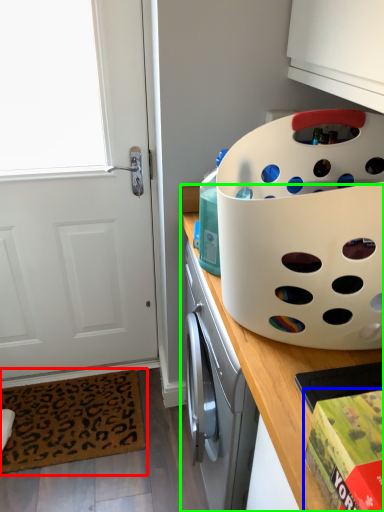
Question: Which is farther away from mat (highlighted by a red box)? box (highlighted by a blue box) or countertop (highlighted by a green box)?

Choices:
 (A) box
 (B) countertop

Answer: (A)